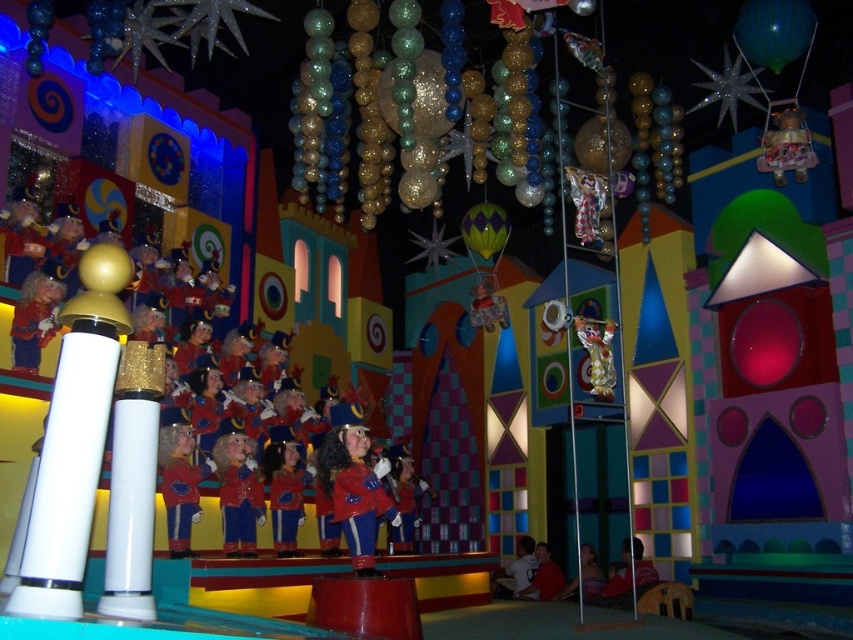
Which is in front, point (740, 26) or point (784, 113)?

Point (740, 26)

Who is more distant from viewer, (782, 61) or (798, 163)?

Positioned behind is point (798, 163).

The width and height of the screenshot is (853, 640). In order to click on green shiny balloon at upper right in this screenshot , I will do `click(773, 32)`.

Can you confirm if glittery metallic balloons at upper center is taller than shiny red uniform at center?

Yes, glittery metallic balloons at upper center is taller than shiny red uniform at center.

Does point (512, 112) come in front of point (367, 531)?

That is False.

Where is `glittery metallic balloons at upper center`? Image resolution: width=853 pixels, height=640 pixels. glittery metallic balloons at upper center is located at coordinates (376, 96).

Where is `glittery metallic balloons at upper center`? glittery metallic balloons at upper center is located at coordinates (376, 96).

Is matte red toy at center to the left of matte red uniform at center from the viewer's perspective?

In fact, matte red toy at center is to the right of matte red uniform at center.

Does matte red toy at center come behind matte red uniform at center?

That is True.

Does point (242, 506) lie in front of point (173, 536)?

No, it is behind (173, 536).

This screenshot has height=640, width=853. I want to click on matte red toy at center, so click(x=238, y=492).